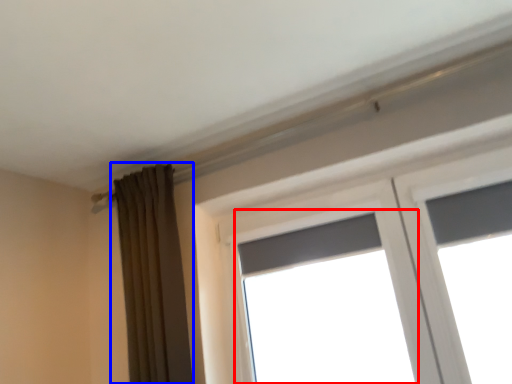
Question: Among these objects, which one is farthest to the camera, window (highlighted by a red box) or curtain (highlighted by a blue box)?

Choices:
 (A) window
 (B) curtain

Answer: (B)